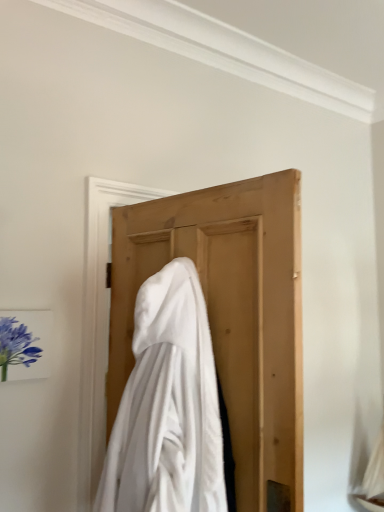
Question: From the image's perspective, is matte purple flower at left above or below white soft cloth at center?

Choices:
 (A) below
 (B) above

Answer: (B)

Question: From a real-world perspective, is matte purple flower at left physically located above or below white soft cloth at center?

Choices:
 (A) below
 (B) above

Answer: (B)

Question: In terms of height, does matte purple flower at left look taller or shorter compared to white soft cloth at center?

Choices:
 (A) short
 (B) tall

Answer: (A)

Question: Is white soft cloth at center taller or shorter than matte purple flower at left?

Choices:
 (A) short
 (B) tall

Answer: (B)

Question: Is white soft cloth at center in front of or behind matte purple flower at left in the image?

Choices:
 (A) behind
 (B) front

Answer: (B)

Question: In terms of size, does white soft cloth at center appear bigger or smaller than matte purple flower at left?

Choices:
 (A) small
 (B) big

Answer: (B)

Question: Would you say white soft cloth at center is inside or outside matte purple flower at left?

Choices:
 (A) inside
 (B) outside

Answer: (B)